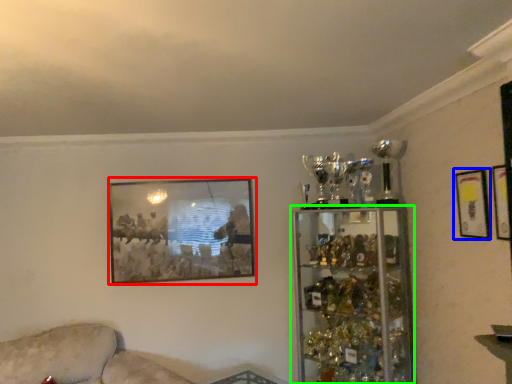
Question: Estimate the real-world distances between objects in this image. Which object is closer to picture frame (highlighted by a red box), picture frame (highlighted by a blue box) or shelf (highlighted by a green box)?

Choices:
 (A) picture frame
 (B) shelf

Answer: (B)